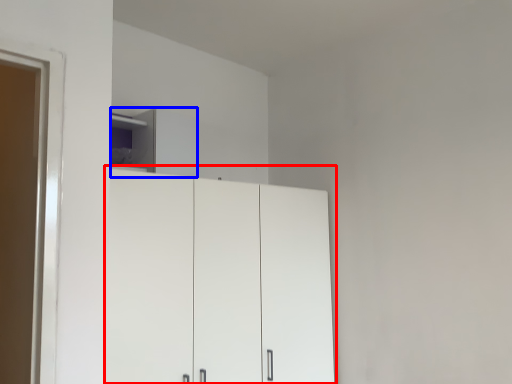
Question: Which object appears farthest to the camera in this image, cupboard (highlighted by a red box) or cabinetry (highlighted by a blue box)?

Choices:
 (A) cupboard
 (B) cabinetry

Answer: (B)